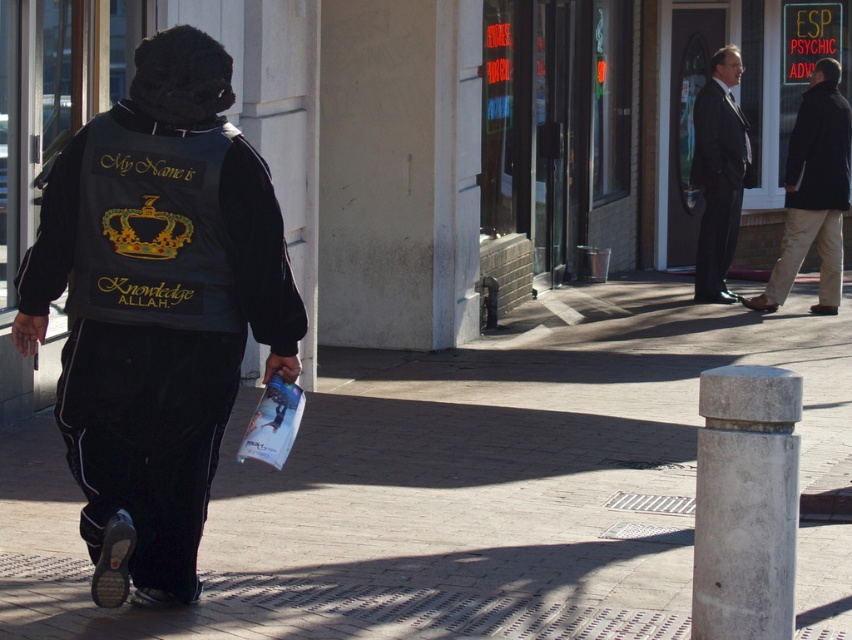
Question: Which of the following is the farthest from the observer?

Choices:
 (A) velvet black jacket at center
 (B) black glossy suit at right
 (C) black matte suit at upper right

Answer: (B)

Question: Is black matte sweatshirt at upper right further to the viewer compared to black matte suit at upper right?

Choices:
 (A) no
 (B) yes

Answer: (A)

Question: Which object appears farthest from the camera in this image?

Choices:
 (A) black matte jacket at center
 (B) black matte suit at upper right
 (C) dark brown leather coat at right
 (D) brick pavement at lower center

Answer: (B)

Question: Can you confirm if brick pavement at lower center is positioned to the right of black matte sweatshirt at upper right?

Choices:
 (A) yes
 (B) no

Answer: (B)

Question: Can you confirm if velvet black jacket at center is bigger than black matte suit at upper right?

Choices:
 (A) no
 (B) yes

Answer: (B)

Question: Which of these objects is positioned farthest from the black matte jacket at center?

Choices:
 (A) black glossy suit at right
 (B) black matte suit at upper right

Answer: (A)